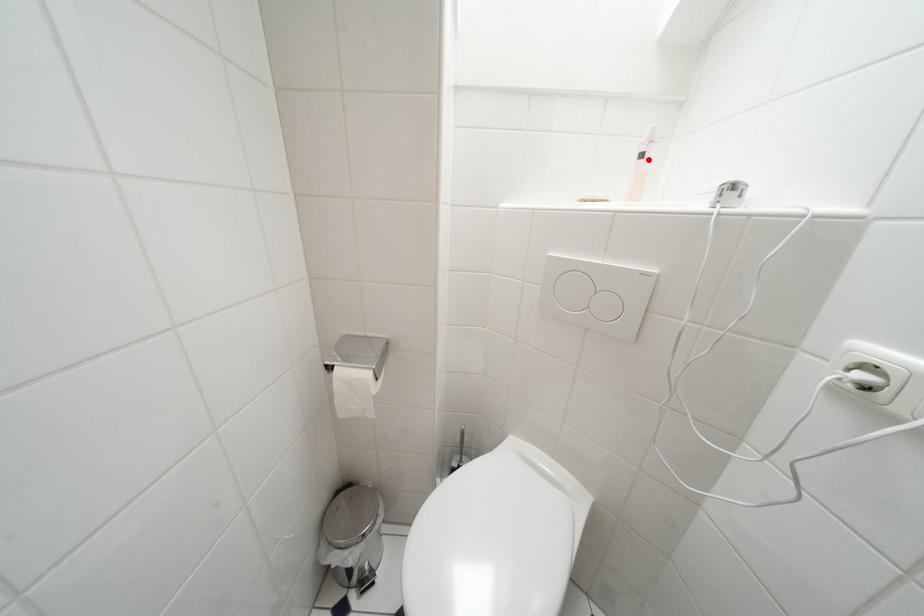
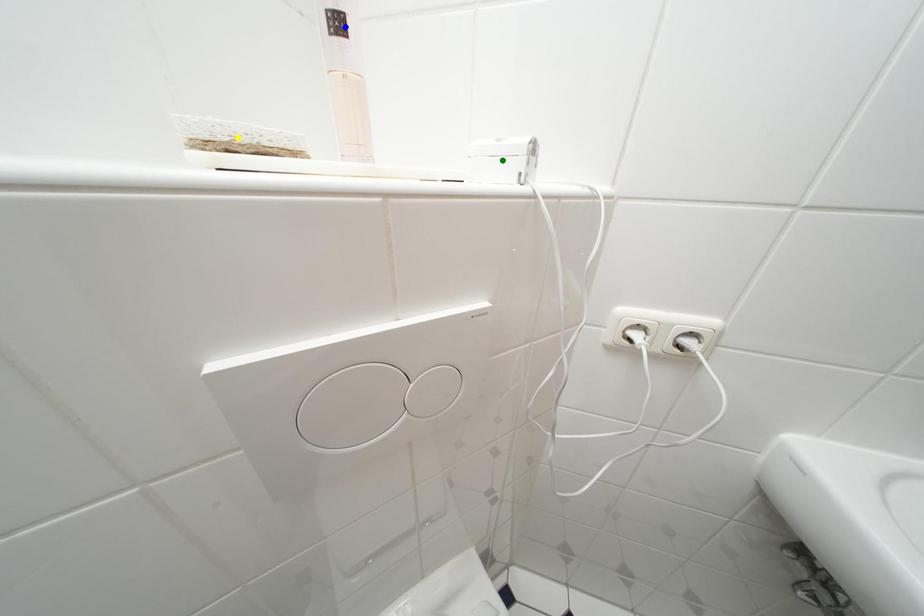
Question: I am providing you with two images of the same scene from different viewpoints. A red point is marked on the first image. You are given multiple points on the second image. In image 2, which mark is for the same physical point as the one in image 1?

Choices:
 (A) yellow point
 (B) blue point
 (C) green point

Answer: (B)